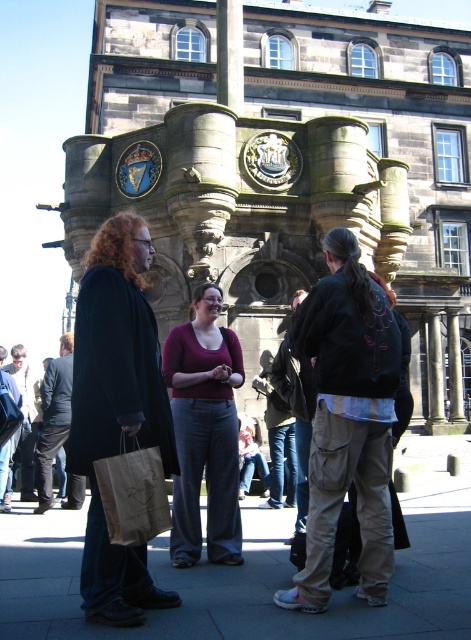
Does concrete pavement at center have a lesser height compared to brown paper bag at lower left?

Yes.

Is point (54, 572) positioned before point (137, 536)?

No.

This screenshot has height=640, width=471. What do you see at coordinates (257, 573) in the screenshot?
I see `concrete pavement at center` at bounding box center [257, 573].

Identify the location of concrete pavement at center. The image size is (471, 640). coord(257,573).

Is concrete pavement at center positioned behind matte burgundy sweater at center?

That is False.

Can you confirm if concrete pavement at center is positioned above matte burgundy sweater at center?

Actually, concrete pavement at center is below matte burgundy sweater at center.

This screenshot has height=640, width=471. Describe the element at coordinates (257, 573) in the screenshot. I see `concrete pavement at center` at that location.

Where is `concrete pavement at center`? This screenshot has width=471, height=640. concrete pavement at center is located at coordinates (257, 573).

From the picture: Who is taller, matte burgundy sweater at center or brown paper bag at lower left?

matte burgundy sweater at center

Does point (191, 486) come behind point (136, 467)?

Yes, point (191, 486) is farther from viewer.

The image size is (471, 640). Identify the location of matte burgundy sweater at center. (204, 432).